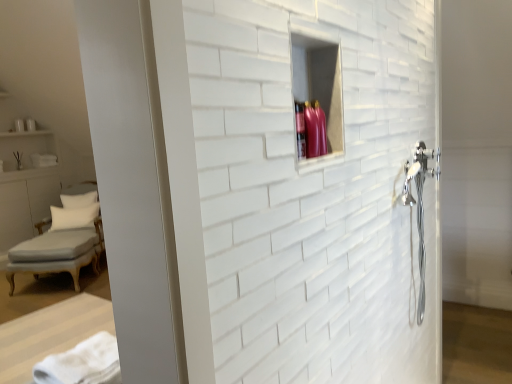
Question: Is white soft pillow at left, which is the 1th pillow in front-to-back order, completely or partially inside white soft towel at lower left?

Choices:
 (A) yes
 (B) no

Answer: (B)

Question: From a real-world perspective, does white soft towel at lower left sit lower than white soft pillow at left, which is the 1th pillow in front-to-back order?

Choices:
 (A) yes
 (B) no

Answer: (B)

Question: Considering the relative sizes of white soft towel at lower left and white soft pillow at left, which is the 1th pillow in front-to-back order, in the image provided, is white soft towel at lower left taller than white soft pillow at left, which is the 1th pillow in front-to-back order,?

Choices:
 (A) no
 (B) yes

Answer: (A)

Question: From the image's perspective, would you say white soft towel at lower left is shown under white soft pillow at left, which is the second pillow from back to front?

Choices:
 (A) yes
 (B) no

Answer: (A)

Question: Is white soft towel at lower left further to camera compared to white soft pillow at left, which is the second pillow from back to front?

Choices:
 (A) yes
 (B) no

Answer: (B)

Question: Is the depth of white soft towel at lower left less than that of white soft pillow at left, which is the second pillow from back to front?

Choices:
 (A) no
 (B) yes

Answer: (B)

Question: Is white fabric pillow at left, which is the 2th pillow from front to back, wider than white soft pillow at left, which is the 1th pillow in front-to-back order?

Choices:
 (A) no
 (B) yes

Answer: (A)

Question: From a real-world perspective, is white fabric pillow at left, which is the 2th pillow from front to back, physically above white soft pillow at left, which is the 1th pillow in front-to-back order?

Choices:
 (A) yes
 (B) no

Answer: (A)

Question: Would you say white fabric pillow at left, which is the 2th pillow from front to back, contains white soft pillow at left, which is the second pillow from back to front?

Choices:
 (A) yes
 (B) no

Answer: (B)

Question: Are white fabric pillow at left, which is the first pillow in back-to-front order, and white soft pillow at left, which is the second pillow from back to front, beside each other?

Choices:
 (A) yes
 (B) no

Answer: (B)

Question: Is white fabric pillow at left, which is the first pillow in back-to-front order, facing away from white soft pillow at left, which is the 1th pillow in front-to-back order?

Choices:
 (A) yes
 (B) no

Answer: (B)

Question: Is white fabric pillow at left, which is the 2th pillow from front to back, to the left of white soft pillow at left, which is the second pillow from back to front, from the viewer's perspective?

Choices:
 (A) yes
 (B) no

Answer: (A)

Question: Does white soft pillow at left, which is the second pillow from back to front, have a lesser height compared to light gray fabric chaise at lower left?

Choices:
 (A) yes
 (B) no

Answer: (A)